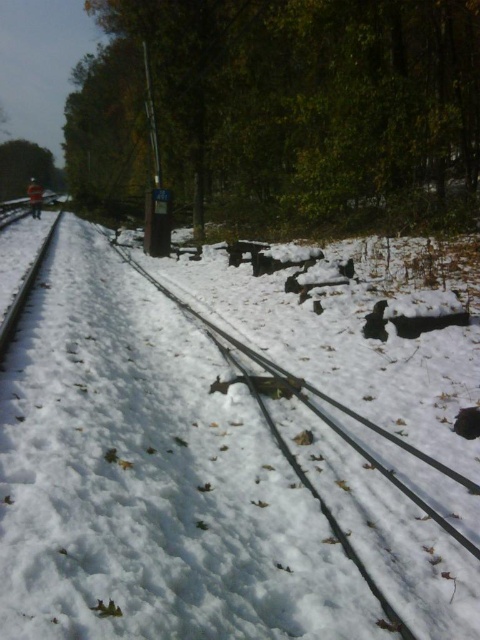
You are a railway inspector checking the tracks. You notice the white matte snow at center and the smooth metal train track at left. Which object is located to the right of the other?

The white matte snow at center is positioned on the right side of smooth metal train track at left.

You are a railway inspector checking the tracks in this snowy area. You notice a specific point marked at coordinates (151, 477). What is located at that point?

The point at coordinates (151, 477) marks white matte snow at center.